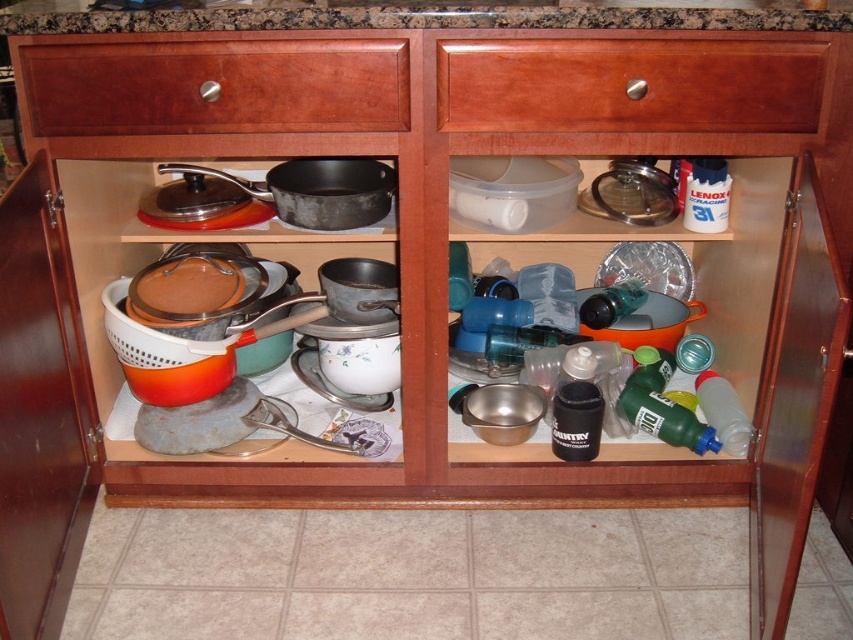
Question: Is granite countertop at upper center smaller than green matte bottle at center-right?

Choices:
 (A) no
 (B) yes

Answer: (A)

Question: Can you confirm if granite countertop at upper center is positioned above translucent plastic bottle at right?

Choices:
 (A) no
 (B) yes

Answer: (B)

Question: Is wooden drawer at upper center further to camera compared to wooden drawer at upper left?

Choices:
 (A) no
 (B) yes

Answer: (A)

Question: Which point is closer to the camera taking this photo?

Choices:
 (A) (654, 390)
 (B) (233, 83)
 (C) (688, 173)
 (D) (619, 300)

Answer: (B)

Question: Which is nearer to the green matte bottle at center-right?

Choices:
 (A) white plastic bottle at upper right
 (B) wooden drawer at upper center
 (C) granite countertop at upper center

Answer: (A)

Question: Among these points, which one is farthest from the camera?

Choices:
 (A) (656, 428)
 (B) (722, 433)

Answer: (A)